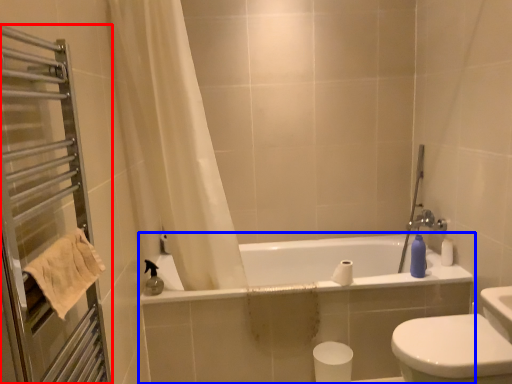
Question: Which object appears farthest to the camera in this image, screen door (highlighted by a red box) or bathtub (highlighted by a blue box)?

Choices:
 (A) screen door
 (B) bathtub

Answer: (B)